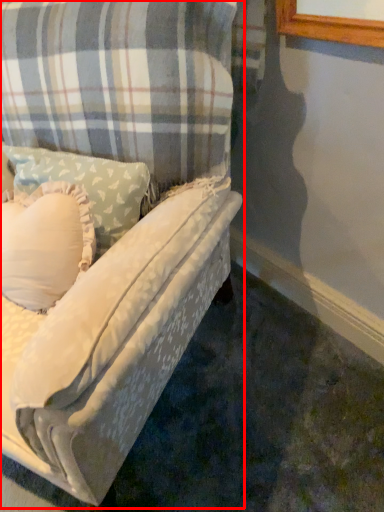
Question: From the image's perspective, where is studio couch (annotated by the red box) located relative to pillow?

Choices:
 (A) above
 (B) below

Answer: (B)